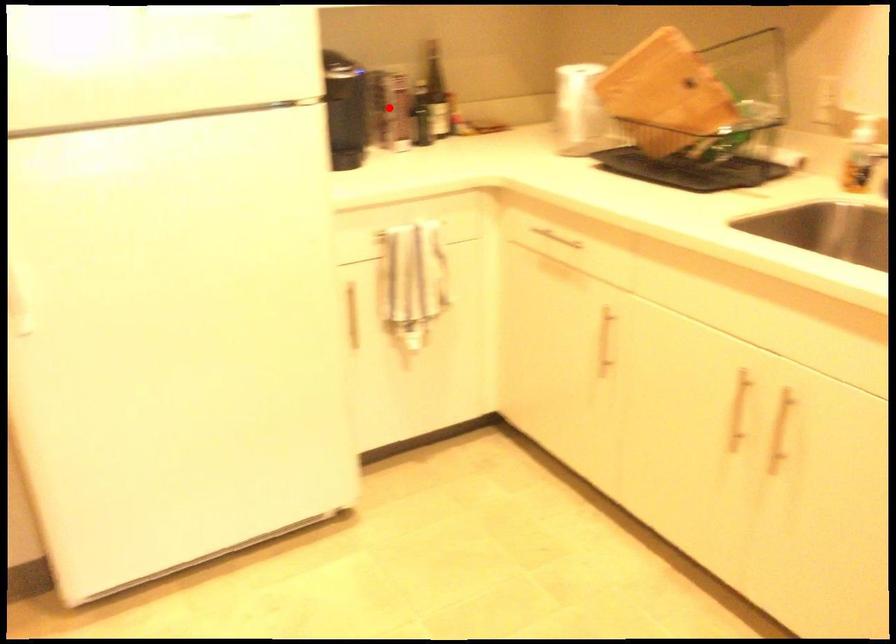
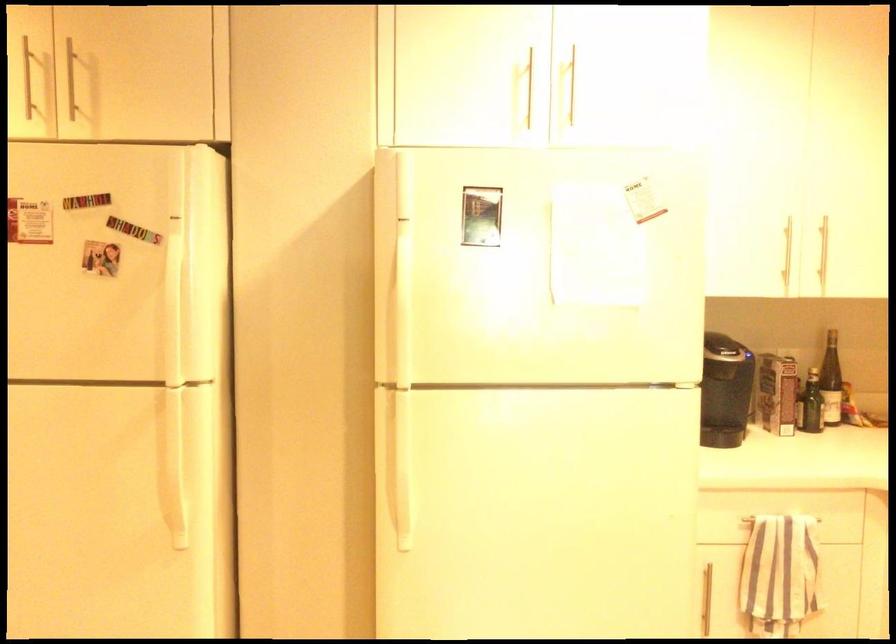
Question: I am providing you with two images of the same scene from different viewpoints. A red point is marked on the first image. Can you still see the location of the red point in image 2?

Choices:
 (A) Yes
 (B) No

Answer: (A)